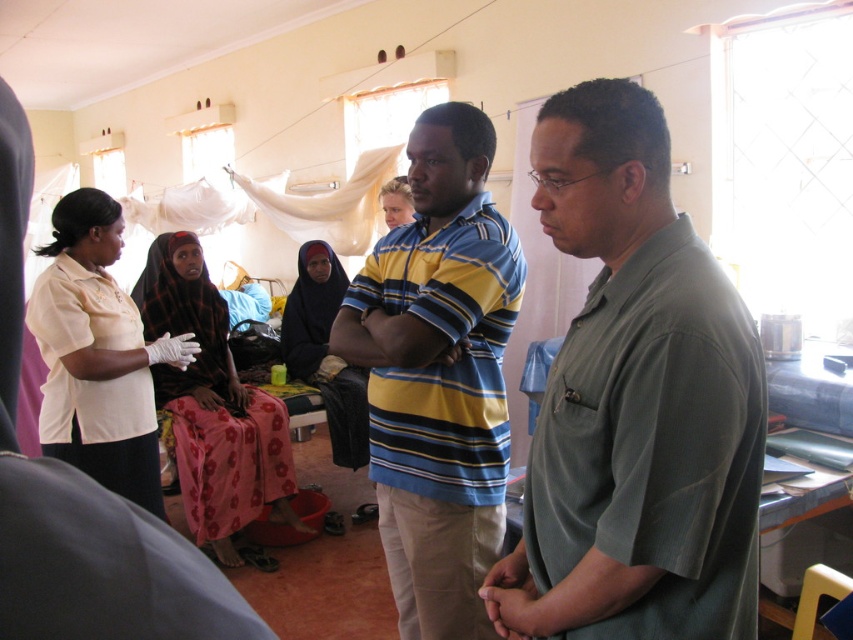
You are a healthcare worker in the clinic and need to locate the striped cotton shirt at center for a patient. Based on the coordinates provided, where exactly would you find it in the room?

The striped cotton shirt at center is located at point 0.588 on the x axis and 0.515 on the y axis, which is near the center of the room.